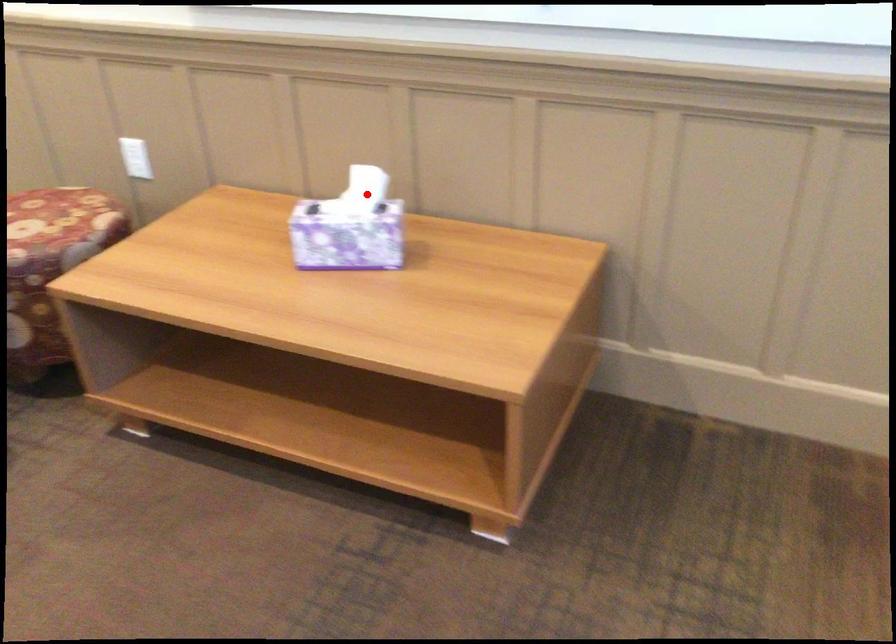
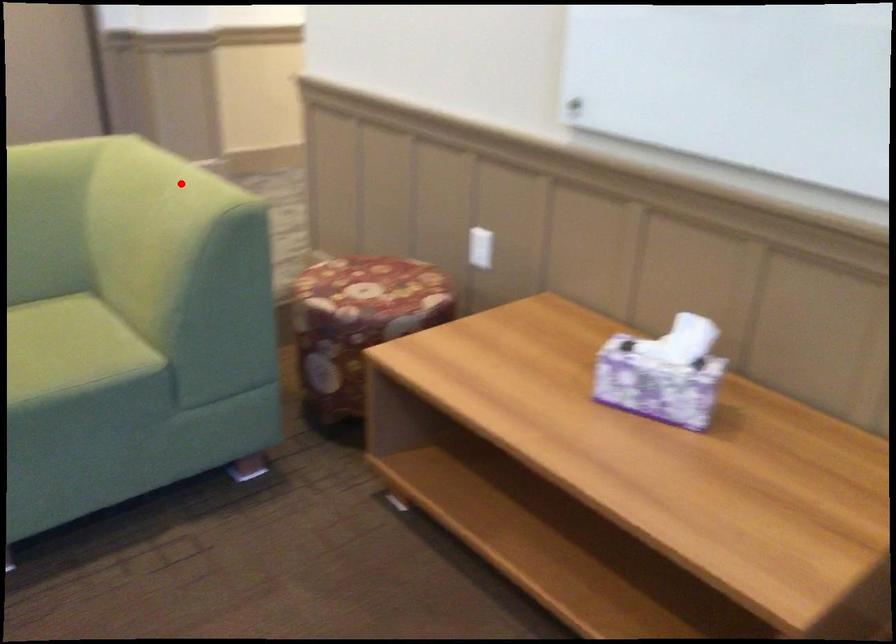
I am providing you with two images of the same scene from different viewpoints. A red point is marked on the first image and another point is marked on the second image. Is the red point in image1 aligned with the point shown in image2?

No